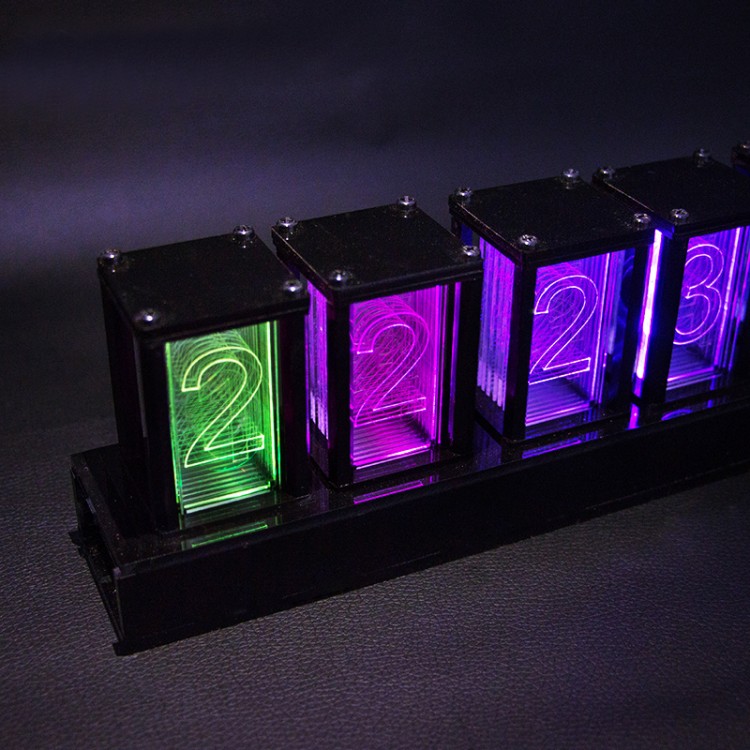
The height and width of the screenshot is (750, 750). Find the location of `floor`. floor is located at coordinates (502, 656), (358, 103).